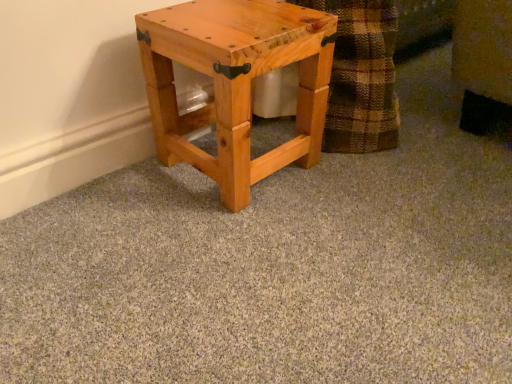
The width and height of the screenshot is (512, 384). I want to click on vacant area to the right of natural wood stool at lower center, so click(354, 173).